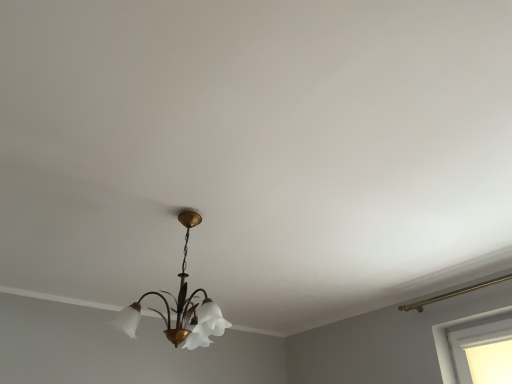
Question: From the image's perspective, is matte gold chandelier at center over white matte window at lower right?

Choices:
 (A) yes
 (B) no

Answer: (A)

Question: Is matte gold chandelier at center positioned in front of white matte window at lower right?

Choices:
 (A) no
 (B) yes

Answer: (B)

Question: Is matte gold chandelier at center far away from white matte window at lower right?

Choices:
 (A) no
 (B) yes

Answer: (B)

Question: Does matte gold chandelier at center appear on the right side of white matte window at lower right?

Choices:
 (A) no
 (B) yes

Answer: (A)

Question: Can you confirm if matte gold chandelier at center is shorter than white matte window at lower right?

Choices:
 (A) yes
 (B) no

Answer: (B)

Question: Is matte gold chandelier at center behind white matte window at lower right?

Choices:
 (A) no
 (B) yes

Answer: (A)

Question: Is white matte window at lower right turned away from matte gold chandelier at center?

Choices:
 (A) yes
 (B) no

Answer: (B)

Question: Considering the relative sizes of white matte window at lower right and matte gold chandelier at center in the image provided, is white matte window at lower right taller than matte gold chandelier at center?

Choices:
 (A) yes
 (B) no

Answer: (B)

Question: Considering the relative sizes of white matte window at lower right and matte gold chandelier at center in the image provided, is white matte window at lower right wider than matte gold chandelier at center?

Choices:
 (A) yes
 (B) no

Answer: (B)

Question: Does white matte window at lower right appear on the right side of matte gold chandelier at center?

Choices:
 (A) no
 (B) yes

Answer: (B)

Question: Does white matte window at lower right have a larger size compared to matte gold chandelier at center?

Choices:
 (A) no
 (B) yes

Answer: (A)

Question: Are white matte window at lower right and matte gold chandelier at center far apart?

Choices:
 (A) no
 (B) yes

Answer: (B)

Question: Considering the positions of white matte window at lower right and matte gold chandelier at center in the image, is white matte window at lower right bigger or smaller than matte gold chandelier at center?

Choices:
 (A) small
 (B) big

Answer: (A)